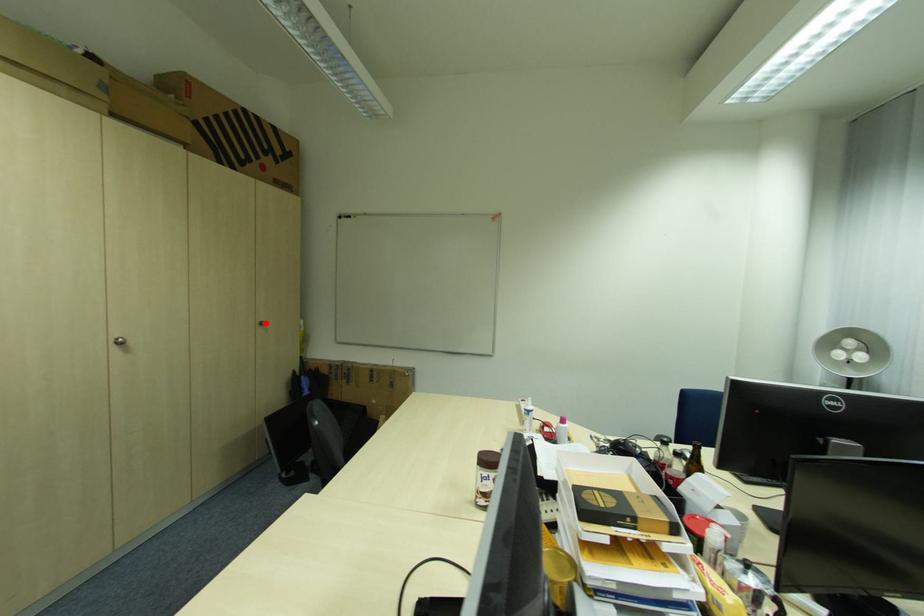
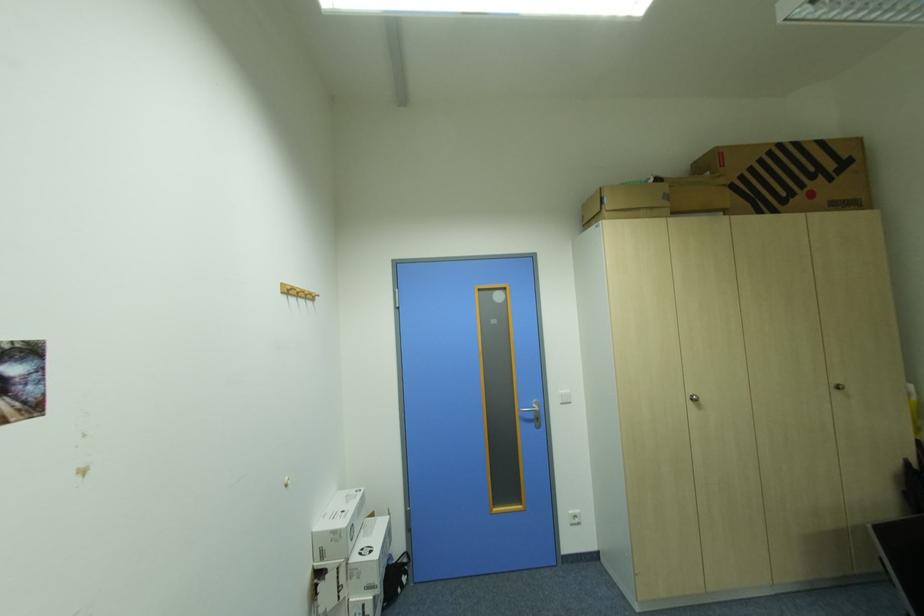
Find the pixel in the second image that matches the highlighted location in the first image.

(840, 386)